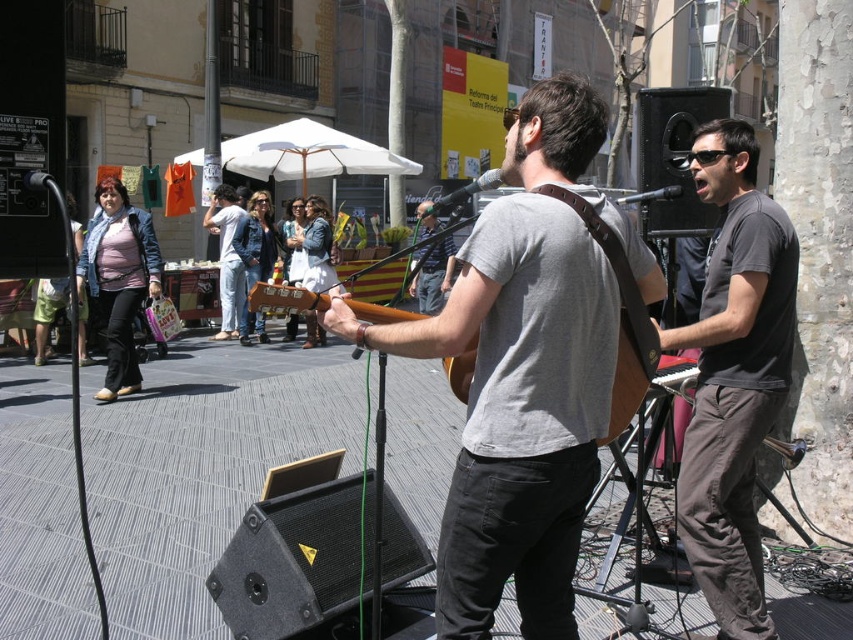
Question: Estimate the real-world distances between objects in this image. Which object is farther from the metallic silver microphone at upper right?

Choices:
 (A) striped cotton shirt at center
 (B) dark gray t-shirt at center
 (C) black matte microphone at center

Answer: (A)

Question: Which point appears closest to the camera in this image?

Choices:
 (A) (563, 449)
 (B) (154, 262)
 (C) (302, 292)
 (D) (724, 467)

Answer: (A)

Question: Where is denim jacket at center located in relation to black matte microphone at center in the image?

Choices:
 (A) below
 (B) above

Answer: (A)

Question: Considering the relative positions of matte pink shirt at left and black matte microphone at center in the image provided, where is matte pink shirt at left located with respect to black matte microphone at center?

Choices:
 (A) above
 (B) below

Answer: (B)

Question: Which point appears closest to the camera in this image?

Choices:
 (A) (221, 225)
 (B) (643, 192)
 (C) (465, 394)
 (D) (434, 288)

Answer: (C)

Question: In this image, where is matte brown guitar at center located relative to denim jacket at center?

Choices:
 (A) right
 (B) left

Answer: (A)